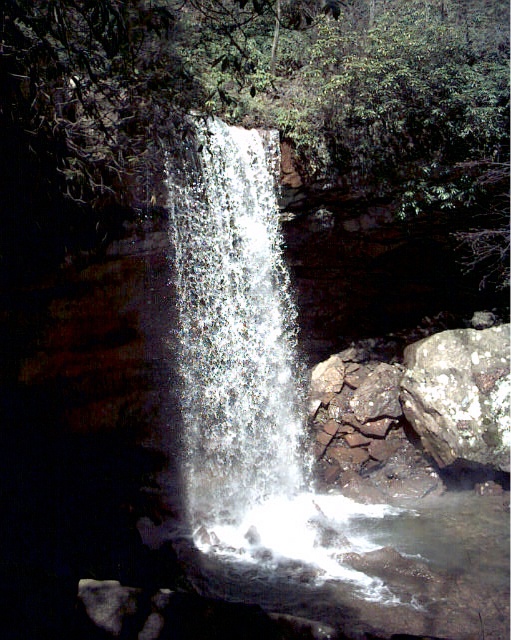
Question: Is clear water at center in front of white speckled rock at center-right?

Choices:
 (A) no
 (B) yes

Answer: (B)

Question: Does clear water at center have a larger size compared to white speckled rock at center-right?

Choices:
 (A) yes
 (B) no

Answer: (B)

Question: Can you confirm if clear water at center is bigger than white speckled rock at center-right?

Choices:
 (A) no
 (B) yes

Answer: (A)